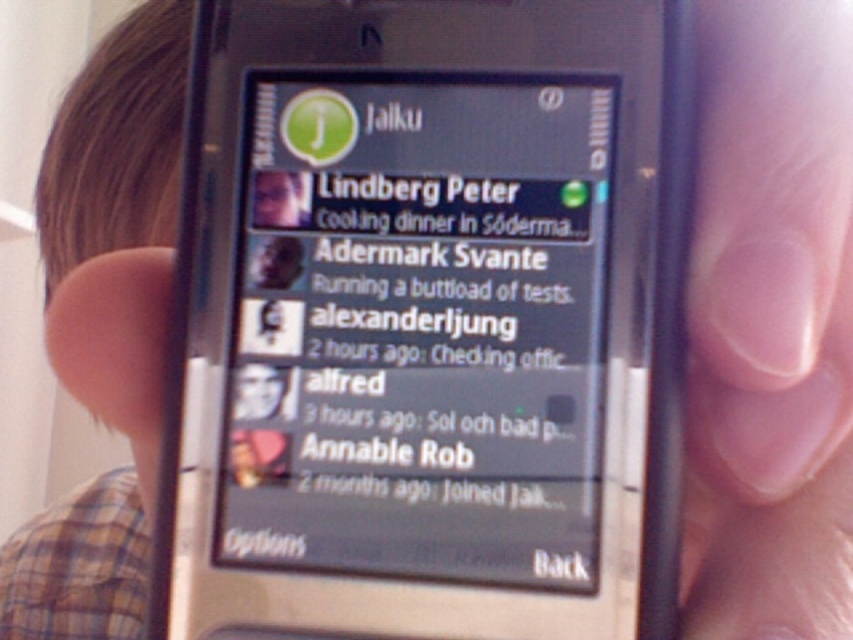
You are a photographer trying to capture a close detail of the phone screen. You notice two points on the screen at coordinates point (570, 561) and point (428, 456). Which point should you focus on to ensure the closest part of the screen is in sharp focus?

Point (570, 561) is closer to the camera than point (428, 456), so focusing on point (570, 561) will ensure the closest part of the screen is in sharp focus.

You are trying to determine if the matte black phone screen at center will fit into a protective case designed for the matte black phone at center. Based on their heights, will the case accommodate the screen?

The matte black phone screen at center has a greater height compared to the matte black phone at center. Therefore, the protective case designed for the matte black phone at center may not accommodate the screen due to its larger height.